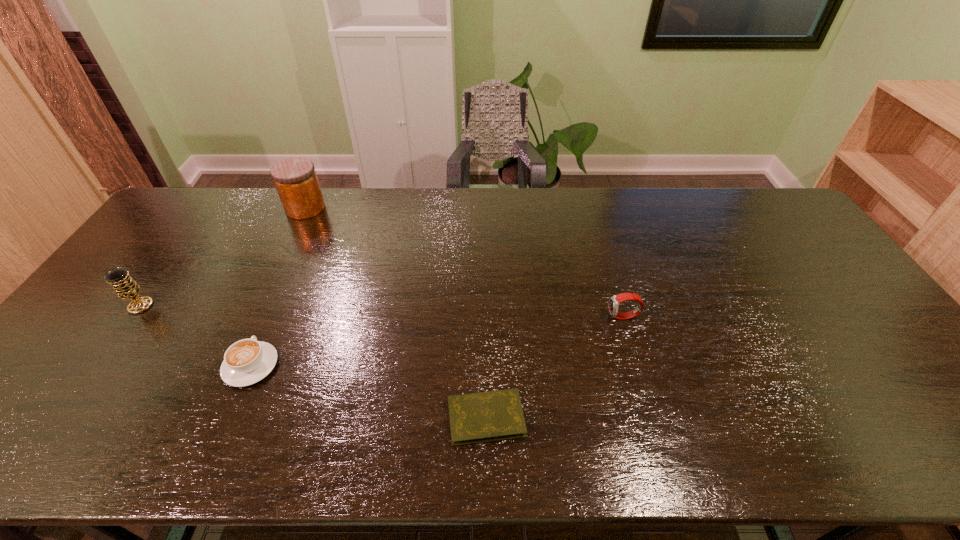
This screenshot has height=540, width=960. What are the coordinates of `jar` in the screenshot? It's located at (295, 179).

Where is `the farthest object`? The image size is (960, 540). the farthest object is located at coordinates (295, 179).

In order to click on the leftmost object in this screenshot , I will do `click(126, 288)`.

Locate an element on the screen. Image resolution: width=960 pixels, height=540 pixels. the fourth shortest object is located at coordinates (126, 288).

This screenshot has width=960, height=540. In order to click on the rightmost object in this screenshot , I will do `click(615, 300)`.

Find the location of a particular element. The height and width of the screenshot is (540, 960). watch is located at coordinates (615, 300).

At what (x,y) coordinates should I click in order to perform the action: click on the fourth farthest object. Please return your answer as a coordinate pair (x, y). Looking at the image, I should click on (247, 361).

Find the location of `the fourth tallest object`. the fourth tallest object is located at coordinates (247, 361).

I want to click on the fourth object from left to right, so click(x=488, y=416).

Identify the location of the nearest object. (488, 416).